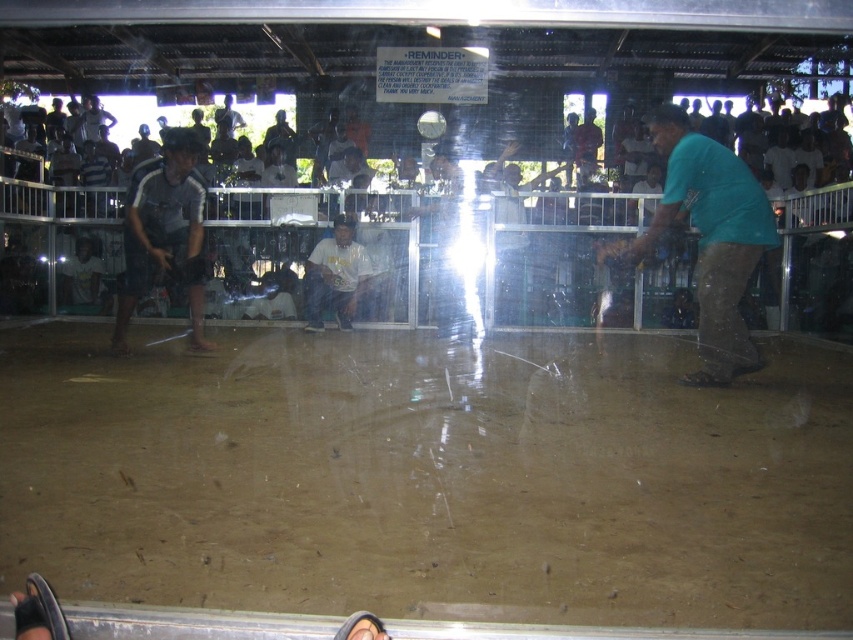
Question: Does white matte shirt at center appear over brown leather sandal at lower center?

Choices:
 (A) yes
 (B) no

Answer: (A)

Question: Which point is farther to the camera?

Choices:
 (A) brown leather sandal at lower center
 (B) striped fabric shirt at left
 (C) white matte shirt at center
 (D) teal fabric shirt at right

Answer: (C)

Question: Which point is closer to the camera taking this photo?

Choices:
 (A) (107, 244)
 (B) (692, 385)

Answer: (B)

Question: Is striped fabric shirt at left closer to camera compared to brown leather sandal at lower center?

Choices:
 (A) yes
 (B) no

Answer: (B)

Question: Among these objects, which one is nearest to the camera?

Choices:
 (A) striped fabric shirt at left
 (B) white matte shirt at center
 (C) white fabric crowd at upper center
 (D) brown leather sandal at lower center

Answer: (C)

Question: Is teal fabric shirt at right below white matte shirt at center?

Choices:
 (A) no
 (B) yes

Answer: (B)